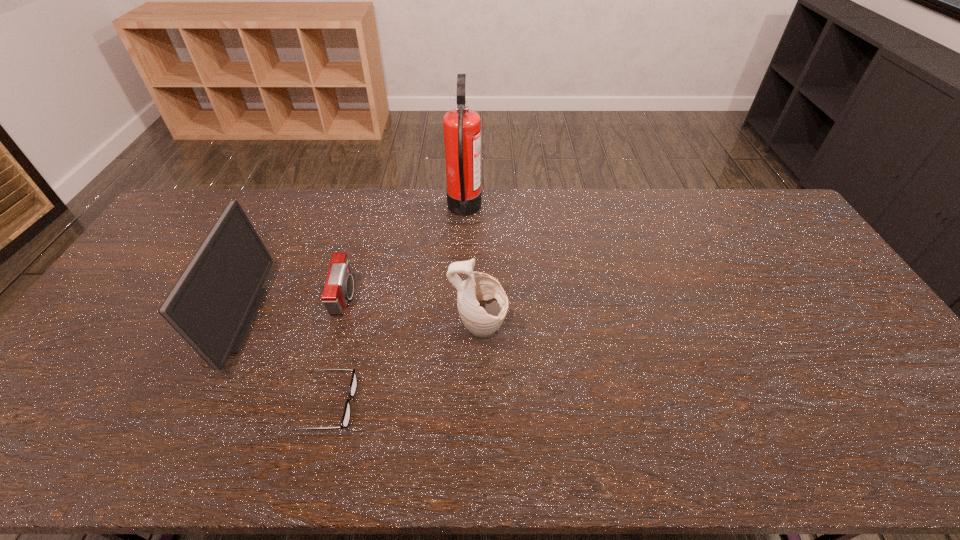
Locate an element on the screen. The width and height of the screenshot is (960, 540). empty location between the farthest object and the shortest object is located at coordinates (396, 307).

I want to click on vacant region between the computer monitor and the fourth tallest object, so click(288, 308).

Where is `vacant area that lies between the second shortest object and the leftmost object`? The width and height of the screenshot is (960, 540). vacant area that lies between the second shortest object and the leftmost object is located at coordinates (288, 308).

This screenshot has height=540, width=960. In order to click on blank region between the second shortest object and the computer monitor in this screenshot , I will do `click(288, 308)`.

You are a GUI agent. You are given a task and a screenshot of the screen. Output one action in this format:
    pyautogui.click(x=<x>, y=<y>)
    Task: Click on the free space between the shortest object and the second shortest object
    
    Given the screenshot: What is the action you would take?
    pyautogui.click(x=337, y=351)

Locate an element on the screen. This screenshot has width=960, height=540. the fourth closest object to the spectacles is located at coordinates (462, 127).

Where is `object that can be found as the second closest to the computer monitor`? This screenshot has width=960, height=540. object that can be found as the second closest to the computer monitor is located at coordinates (339, 286).